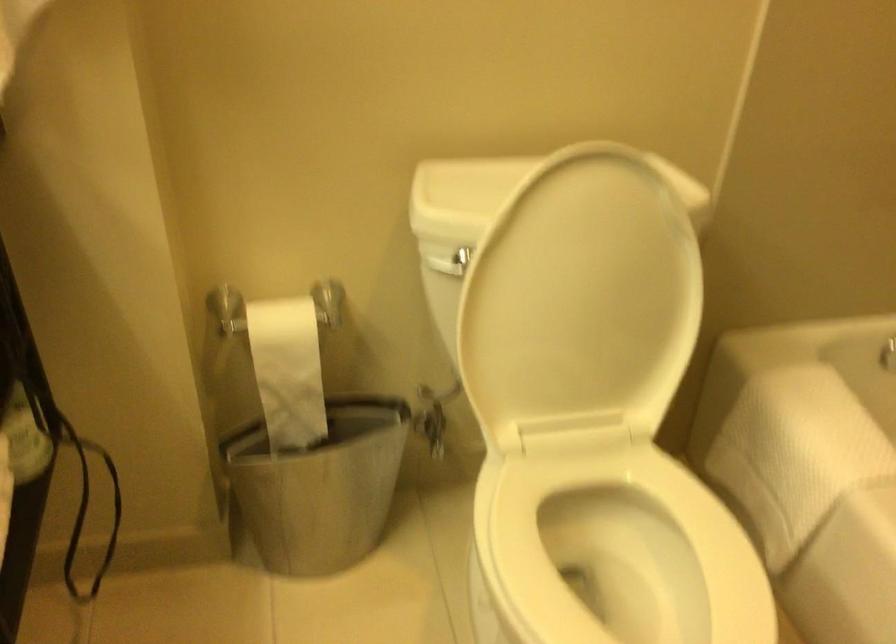
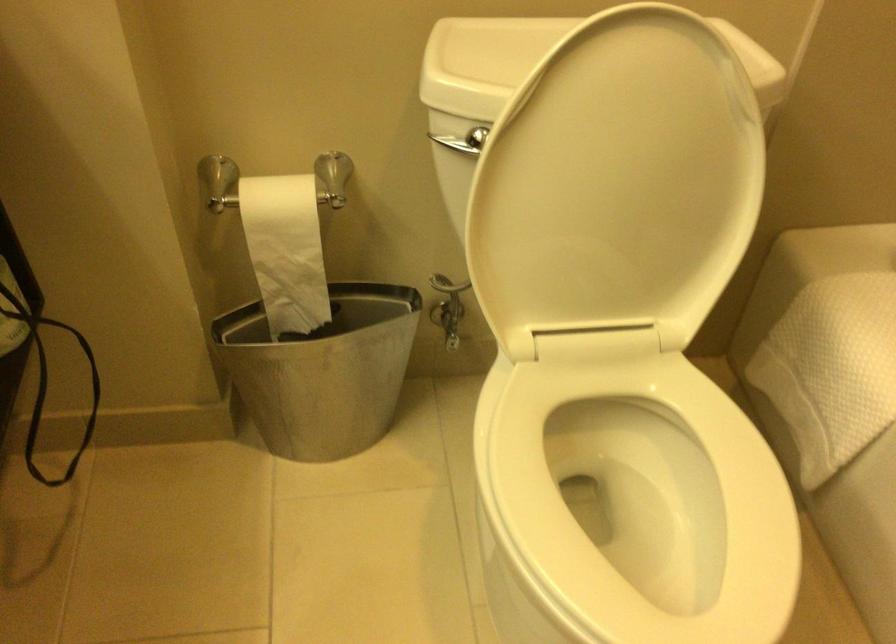
Find the pixel in the second image that matches (x=288, y=372) in the first image.

(286, 250)